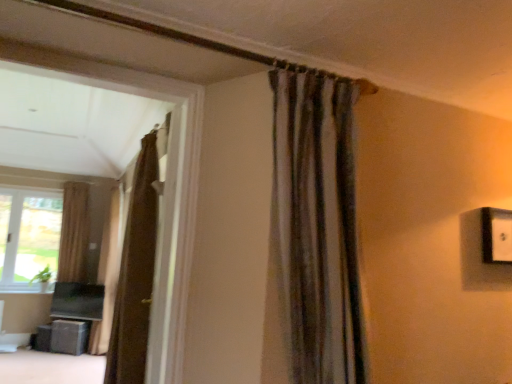
Question: Considering the relative positions of beige fabric curtain at left, which ranks as the fourth curtain in front-to-back order, and brown textured curtain at center, placed as the second curtain when sorted from back to front, in the image provided, is beige fabric curtain at left, which ranks as the fourth curtain in front-to-back order, to the right of brown textured curtain at center, placed as the second curtain when sorted from back to front, from the viewer's perspective?

Choices:
 (A) yes
 (B) no

Answer: (B)

Question: Considering the relative sizes of beige fabric curtain at left, which is counted as the first curtain, starting from the left, and brown textured curtain at center, which ranks as the 3th curtain in right-to-left order, in the image provided, is beige fabric curtain at left, which is counted as the first curtain, starting from the left, bigger than brown textured curtain at center, which ranks as the 3th curtain in right-to-left order,?

Choices:
 (A) no
 (B) yes

Answer: (A)

Question: Considering the relative sizes of beige fabric curtain at left, the 4th curtain in the right-to-left sequence, and brown textured curtain at center, which ranks as the 3th curtain in right-to-left order, in the image provided, is beige fabric curtain at left, the 4th curtain in the right-to-left sequence, taller than brown textured curtain at center, which ranks as the 3th curtain in right-to-left order,?

Choices:
 (A) yes
 (B) no

Answer: (B)

Question: Could brown textured curtain at center, the third curtain viewed from the front, be considered to be inside beige fabric curtain at left, acting as the first curtain starting from the back?

Choices:
 (A) no
 (B) yes

Answer: (A)

Question: From a real-world perspective, is beige fabric curtain at left, the 4th curtain in the right-to-left sequence, under brown textured curtain at center, placed as the second curtain when sorted from back to front?

Choices:
 (A) yes
 (B) no

Answer: (B)

Question: In terms of size, does matte black speaker at lower left appear bigger or smaller than clear glass window at left?

Choices:
 (A) small
 (B) big

Answer: (A)

Question: From the image's perspective, is matte black speaker at lower left above or below clear glass window at left?

Choices:
 (A) above
 (B) below

Answer: (B)

Question: Is matte black speaker at lower left in front of or behind clear glass window at left in the image?

Choices:
 (A) behind
 (B) front

Answer: (B)

Question: Considering the relative positions of matte black speaker at lower left and clear glass window at left in the image provided, is matte black speaker at lower left to the left or to the right of clear glass window at left?

Choices:
 (A) left
 (B) right

Answer: (B)

Question: In terms of height, does transparent plastic screen door at center look taller or shorter compared to beige fabric curtain at left, the 4th curtain in the right-to-left sequence?

Choices:
 (A) short
 (B) tall

Answer: (A)

Question: From the image's perspective, is transparent plastic screen door at center above or below beige fabric curtain at left, which is counted as the first curtain, starting from the left?

Choices:
 (A) below
 (B) above

Answer: (B)

Question: Is transparent plastic screen door at center in front of or behind beige fabric curtain at left, acting as the first curtain starting from the back, in the image?

Choices:
 (A) front
 (B) behind

Answer: (A)

Question: From a real-world perspective, is transparent plastic screen door at center above or below beige fabric curtain at left, acting as the first curtain starting from the back?

Choices:
 (A) below
 (B) above

Answer: (A)

Question: Considering the positions of clear glass window at left and transparent plastic screen door at center in the image, is clear glass window at left taller or shorter than transparent plastic screen door at center?

Choices:
 (A) short
 (B) tall

Answer: (A)

Question: Is clear glass window at left inside or outside of transparent plastic screen door at center?

Choices:
 (A) inside
 (B) outside

Answer: (B)